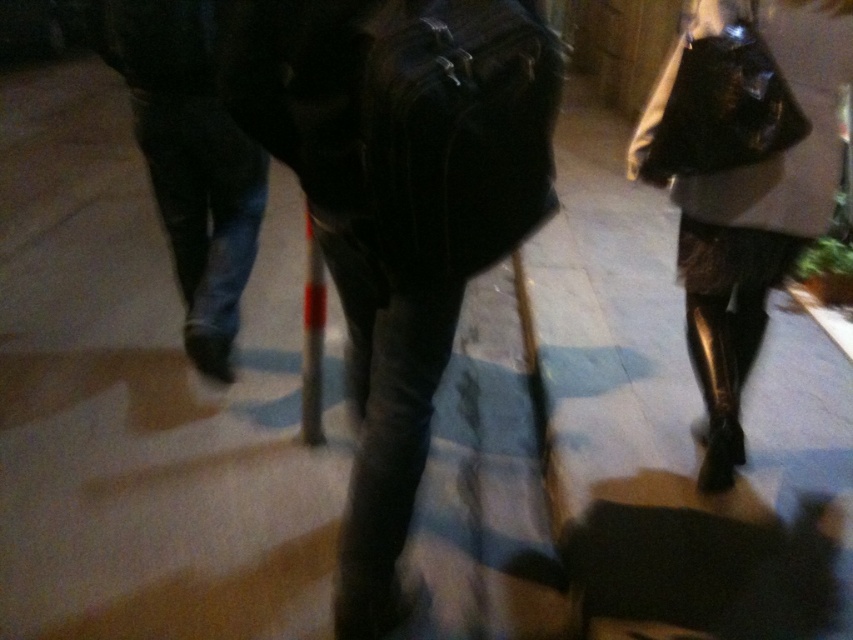
Question: Among these points, which one is farthest from the camera?

Choices:
 (A) (207, 339)
 (B) (723, 52)

Answer: (A)

Question: Among these points, which one is farthest from the camera?

Choices:
 (A) (781, 144)
 (B) (178, 260)

Answer: (B)

Question: Which point is closer to the camera taking this photo?

Choices:
 (A) (677, 237)
 (B) (183, 196)

Answer: (B)

Question: Is shiny metallic boots at lower right positioned before dark denim jeans at left?

Choices:
 (A) no
 (B) yes

Answer: (B)

Question: Observing the image, what is the correct spatial positioning of shiny metallic boots at lower right in reference to dark denim jeans at left?

Choices:
 (A) below
 (B) above

Answer: (A)

Question: Is shiny metallic boots at lower right wider than dark denim jeans at left?

Choices:
 (A) no
 (B) yes

Answer: (B)